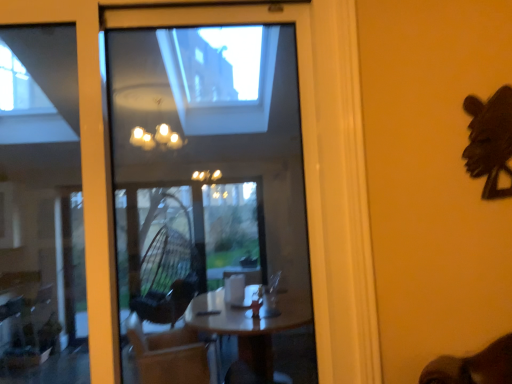
Question: Considering the positions of point (494, 160) and point (101, 276), is point (494, 160) closer or farther from the camera than point (101, 276)?

Choices:
 (A) farther
 (B) closer

Answer: (A)

Question: From a real-world perspective, is black matte mask at upper right physically located above or below transparent glass window at center?

Choices:
 (A) below
 (B) above

Answer: (B)

Question: Considering their positions, is black matte mask at upper right located in front of or behind transparent glass window at center?

Choices:
 (A) behind
 (B) front

Answer: (A)

Question: Visually, is transparent glass window at center positioned to the left or to the right of black matte mask at upper right?

Choices:
 (A) left
 (B) right

Answer: (A)

Question: Is transparent glass window at center taller or shorter than black matte mask at upper right?

Choices:
 (A) short
 (B) tall

Answer: (B)

Question: Choose the correct answer: Is transparent glass window at center inside black matte mask at upper right or outside it?

Choices:
 (A) inside
 (B) outside

Answer: (B)

Question: Considering their positions, is transparent glass window at center located in front of or behind black matte mask at upper right?

Choices:
 (A) front
 (B) behind

Answer: (A)